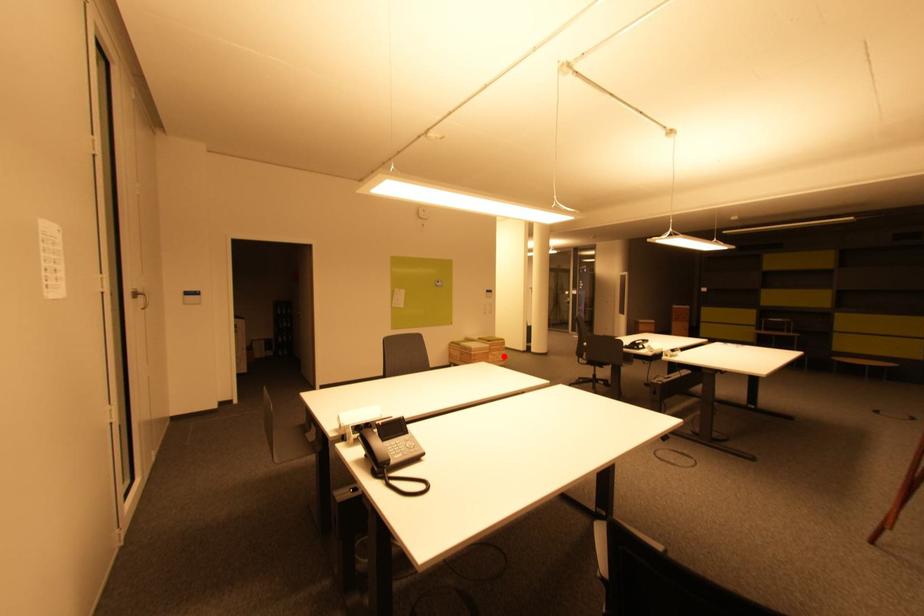
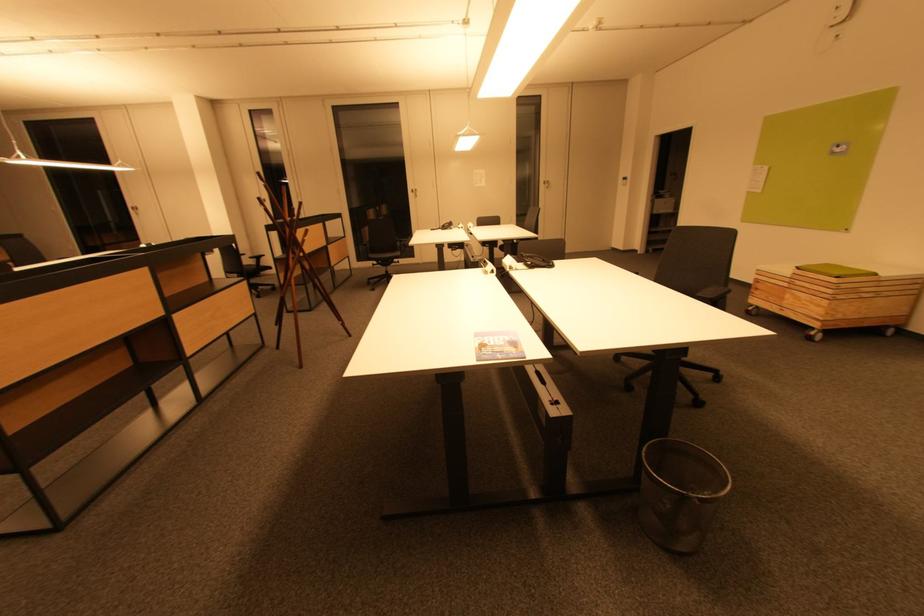
Where in the second image is the point corresponding to the highlighted location from the first image?

(816, 305)